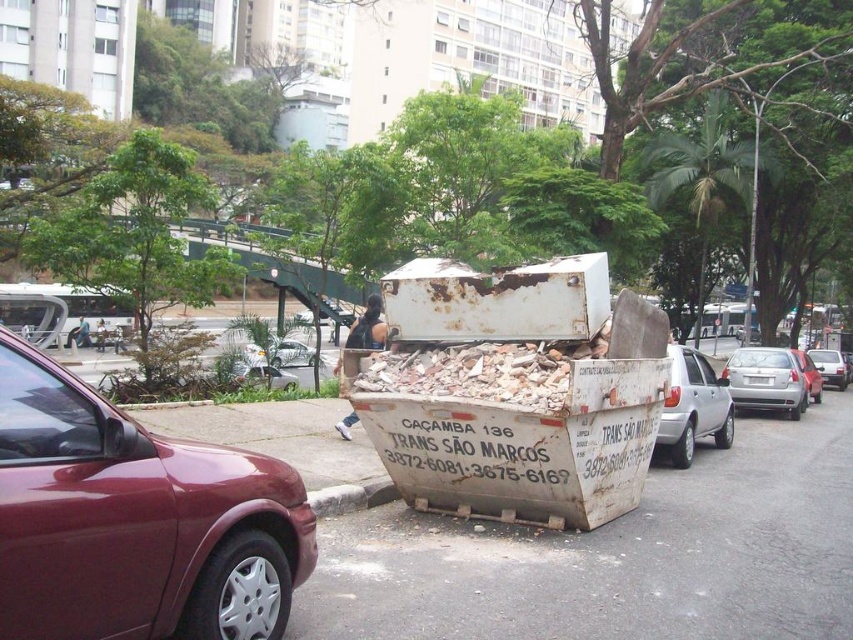
Question: Does maroon metallic car at left have a larger size compared to metallic silver sedan at center?

Choices:
 (A) no
 (B) yes

Answer: (A)

Question: In this image, where is silver metallic sedan at center-right located relative to metallic silver sedan at center?

Choices:
 (A) above
 (B) below

Answer: (A)

Question: Considering the real-world distances, which object is closest to the gray concrete curb at lower center?

Choices:
 (A) white matte car at right
 (B) silver metallic sedan at center-right
 (C) maroon metallic car at left
 (D) metallic silver sedan at center

Answer: (C)

Question: Is metallic silver sedan at right further to camera compared to metallic silver sedan at center?

Choices:
 (A) no
 (B) yes

Answer: (B)

Question: Estimate the real-world distances between objects in this image. Which object is closer to the silver metallic sedan at center-right?

Choices:
 (A) gray concrete curb at lower center
 (B) white matte car at right

Answer: (B)

Question: Which object appears farthest from the camera in this image?

Choices:
 (A) white matte car at right
 (B) gray concrete curb at lower center
 (C) silver metallic sedan at center-right
 (D) maroon metallic car at left

Answer: (C)